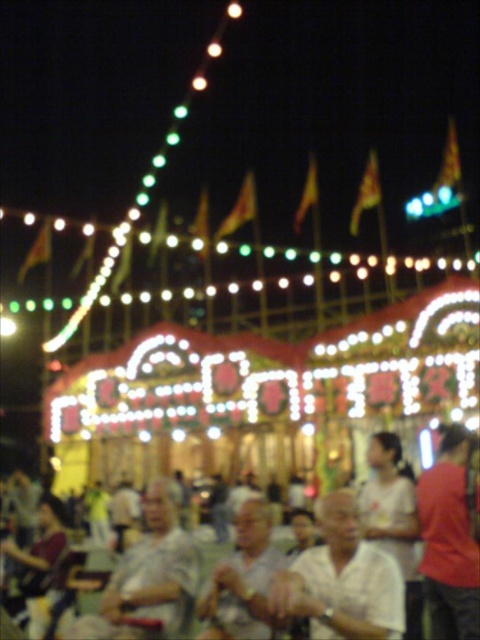
Who is positioned more to the right, red fabric shirt at right or white textured shirt at center?

From the viewer's perspective, red fabric shirt at right appears more on the right side.

Does red fabric shirt at right have a greater height compared to white textured shirt at center?

Yes.

Who is more distant from viewer, (x=459, y=483) or (x=252, y=616)?

Positioned behind is point (x=459, y=483).

Find the location of a particular element. The image size is (480, 640). red fabric shirt at right is located at coordinates (448, 540).

Is white matte shirt at center to the left of white textured shirt at center from the viewer's perspective?

In fact, white matte shirt at center is to the right of white textured shirt at center.

Who is more distant from viewer, (360, 632) or (255, 604)?

The point (255, 604) is more distant.

You are a GUI agent. You are given a task and a screenshot of the screen. Output one action in this format:
    pyautogui.click(x=<x>, y=<y>)
    Task: Click on the white matte shirt at center
    The width and height of the screenshot is (480, 640).
    Given the screenshot: What is the action you would take?
    pyautogui.click(x=343, y=580)

Looking at this image, is gray fabric shirt at lower left taller than red fabric shirt at right?

In fact, gray fabric shirt at lower left may be shorter than red fabric shirt at right.

Between point (191, 586) and point (459, 500), which one is positioned behind?

The point (191, 586) is more distant.

Identify the location of gray fabric shirt at lower left. This screenshot has height=640, width=480. (148, 579).

Where is `gray fabric shirt at lower left`? Image resolution: width=480 pixels, height=640 pixels. gray fabric shirt at lower left is located at coordinates 148,579.